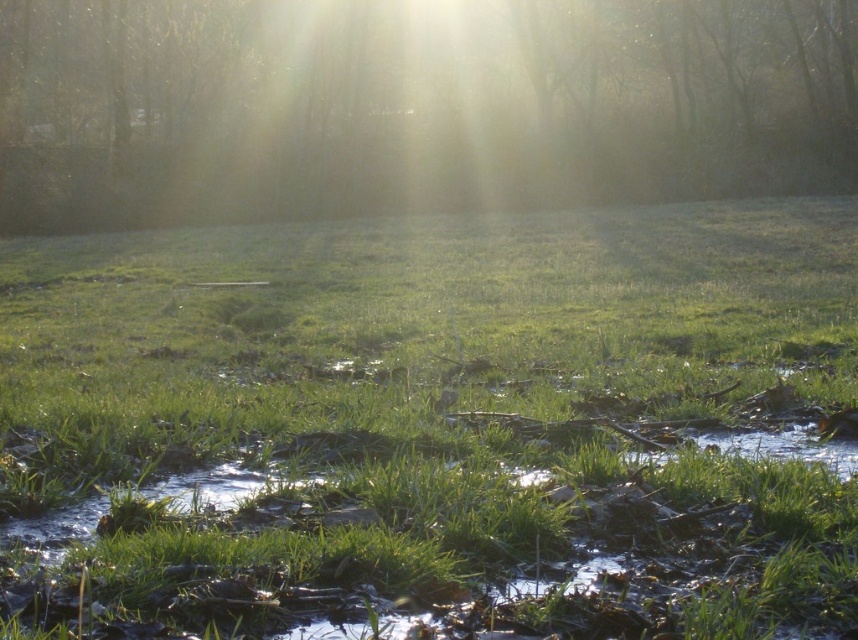
You are standing in the middle of the green grassy at center and looking towards the translucent foggy trees at upper center. Which object is taller?

The translucent foggy trees at upper center are taller than the green grassy at center.

You are standing at the origin point of the scene. Where is the green grassy at center located in terms of coordinates?

The green grassy at center is located at coordinates point (437,426).